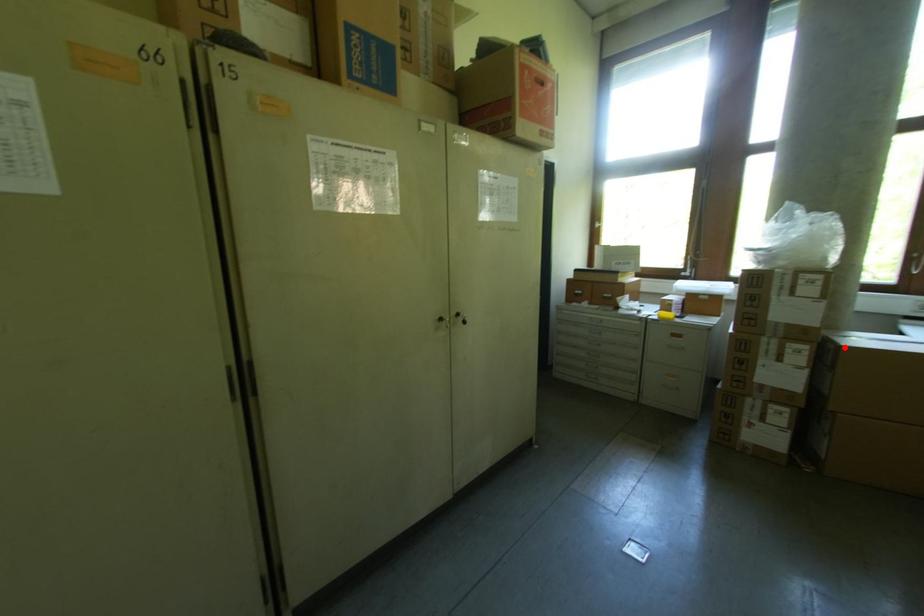
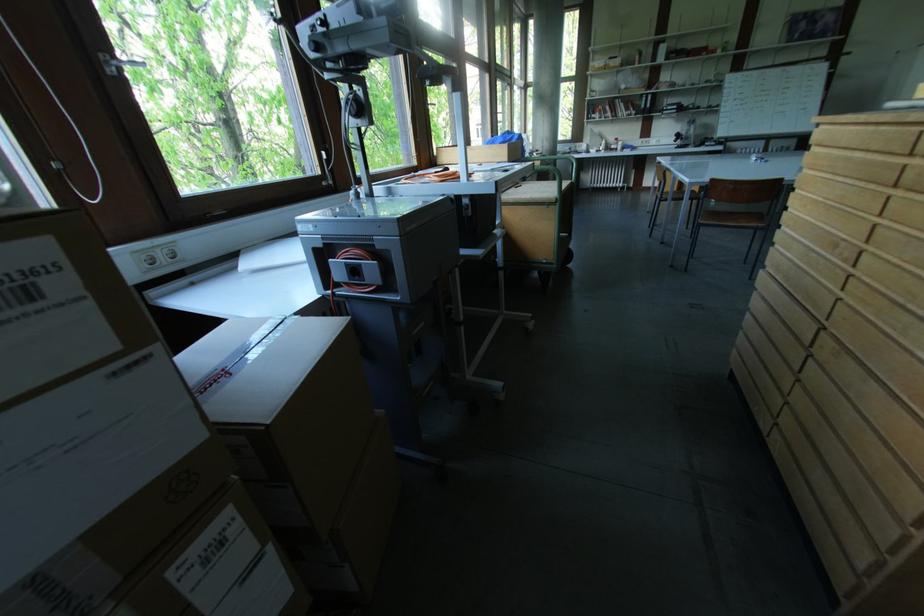
Locate, in the second image, the point that corresponds to the highlighted location in the first image.

(271, 429)